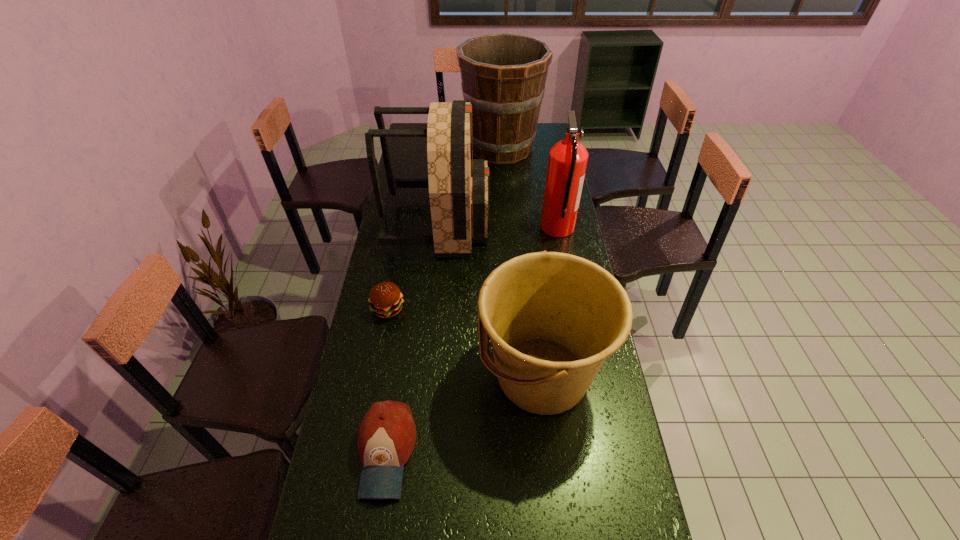
The height and width of the screenshot is (540, 960). Identify the location of vacant space in between the baseball cap and the hamburger. (387, 381).

Where is `free area in between the third nearest object and the baseball cap`? free area in between the third nearest object and the baseball cap is located at coordinates (387, 381).

In order to click on free spot between the third nearest object and the shorter bucket in this screenshot , I will do 465,342.

Find the location of a particular element. Image resolution: width=960 pixels, height=540 pixels. vacant area that lies between the fire extinguisher and the backpack is located at coordinates (498, 226).

The height and width of the screenshot is (540, 960). I want to click on object that is the fourth closest to the nearer bucket, so click(567, 162).

The image size is (960, 540). I want to click on object that ranks as the third closest to the baseball cap, so click(458, 185).

At what (x,y) coordinates should I click in order to perform the action: click on free space that satisfies the following two spatial constraints: 1. on the side of the nearer bucket with the handle; 2. on the front-facing side of the baseball cap. Please return your answer as a coordinate pair (x, y). The height and width of the screenshot is (540, 960). Looking at the image, I should click on (550, 453).